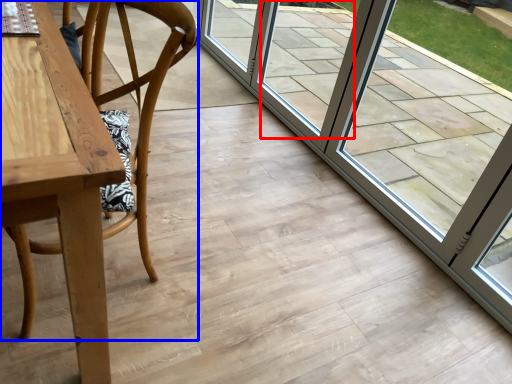
Question: Which object is closer to the camera taking this photo, window (highlighted by a red box) or chair (highlighted by a blue box)?

Choices:
 (A) window
 (B) chair

Answer: (B)